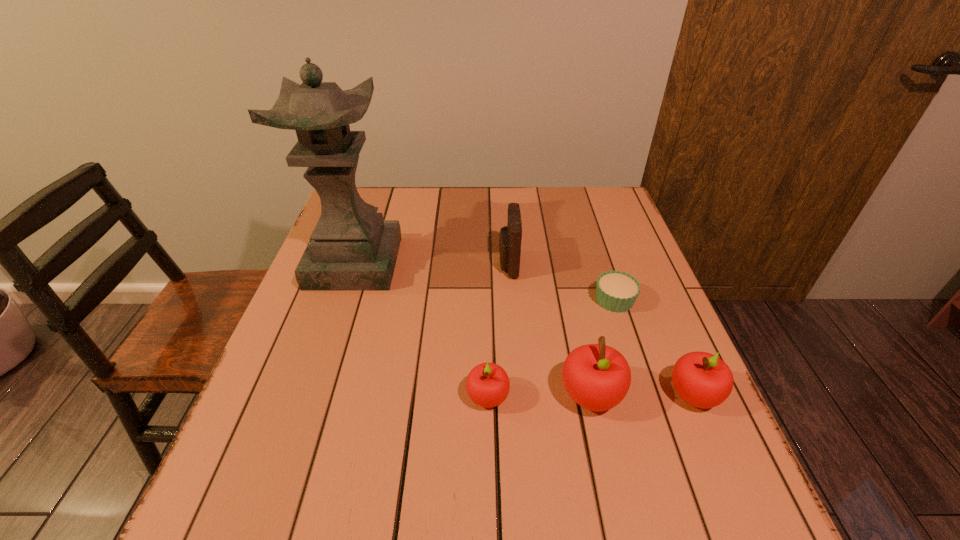
With all apples evenly spaced, where should an extra apple be placed on the left to continue the pattern? Please point out a vacant space. Please provide its 2D coordinates. Your answer should be formatted as a tuple, i.e. [(x, y)], where the tuple contains the x and y coordinates of a point satisfying the conditions above.

[(384, 398)]